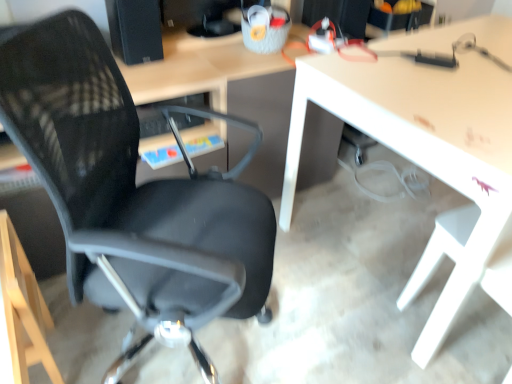
Question: Does black mesh chair at left come behind white glossy table at center?

Choices:
 (A) no
 (B) yes

Answer: (A)

Question: Does black mesh chair at left have a greater width compared to white glossy table at center?

Choices:
 (A) no
 (B) yes

Answer: (A)

Question: Is black mesh chair at left closer to camera compared to white glossy table at center?

Choices:
 (A) yes
 (B) no

Answer: (A)

Question: Can you confirm if black mesh chair at left is shorter than white glossy table at center?

Choices:
 (A) yes
 (B) no

Answer: (B)

Question: Is black mesh chair at left next to white glossy table at center and touching it?

Choices:
 (A) no
 (B) yes

Answer: (A)

Question: From a real-world perspective, is black matte speaker at upper left physically located above or below black mesh chair at left?

Choices:
 (A) above
 (B) below

Answer: (A)

Question: Is black matte speaker at upper left taller or shorter than black mesh chair at left?

Choices:
 (A) short
 (B) tall

Answer: (A)

Question: Is black matte speaker at upper left inside the boundaries of black mesh chair at left, or outside?

Choices:
 (A) outside
 (B) inside

Answer: (A)

Question: Considering the relative positions of black matte speaker at upper left and black mesh chair at left in the image provided, is black matte speaker at upper left to the left or to the right of black mesh chair at left?

Choices:
 (A) right
 (B) left

Answer: (B)

Question: Considering the positions of point tap(475, 279) and point tap(100, 157), is point tap(475, 279) closer or farther from the camera than point tap(100, 157)?

Choices:
 (A) farther
 (B) closer

Answer: (A)

Question: Is white glossy table at center situated inside black mesh chair at left or outside?

Choices:
 (A) outside
 (B) inside

Answer: (A)

Question: From a real-world perspective, is white glossy table at center positioned above or below black mesh chair at left?

Choices:
 (A) above
 (B) below

Answer: (B)

Question: Looking at the image, does white glossy table at center seem bigger or smaller compared to black mesh chair at left?

Choices:
 (A) small
 (B) big

Answer: (B)

Question: In terms of width, does black mesh chair at left look wider or thinner when compared to black matte speaker at upper left?

Choices:
 (A) thin
 (B) wide

Answer: (B)

Question: Is point (26, 155) closer or farther from the camera than point (122, 21)?

Choices:
 (A) closer
 (B) farther

Answer: (A)